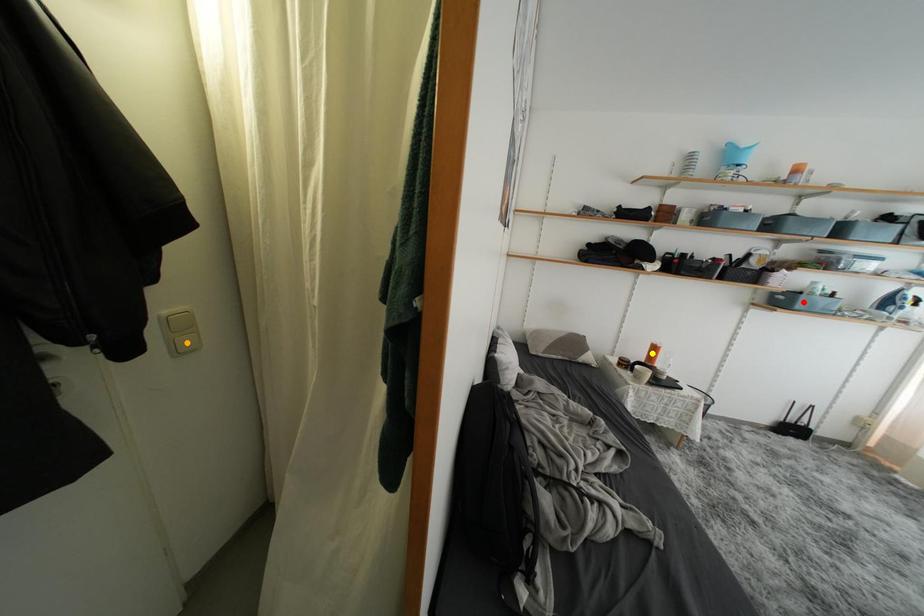
Order these from nearest to farthest:
red point
orange point
yellow point

yellow point, red point, orange point